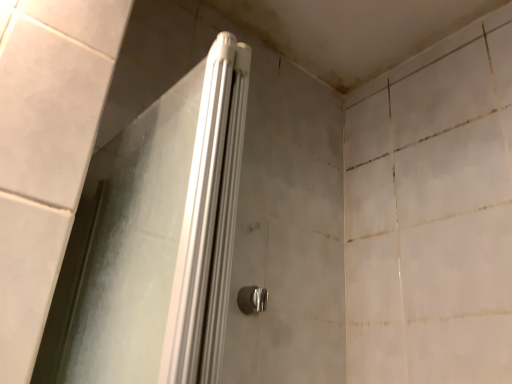
Measure the distance between polished silver door handle at lower center and camera.

78.30 centimeters.

You are a GUI agent. You are given a task and a screenshot of the screen. Output one action in this format:
    pyautogui.click(x=<x>, y=<y>)
    Task: Click on the polished silver door handle at lower center
    
    Given the screenshot: What is the action you would take?
    pyautogui.click(x=252, y=299)

What do you see at coordinates (252, 299) in the screenshot? I see `polished silver door handle at lower center` at bounding box center [252, 299].

Identify the location of polished silver door handle at lower center. This screenshot has width=512, height=384. (252, 299).